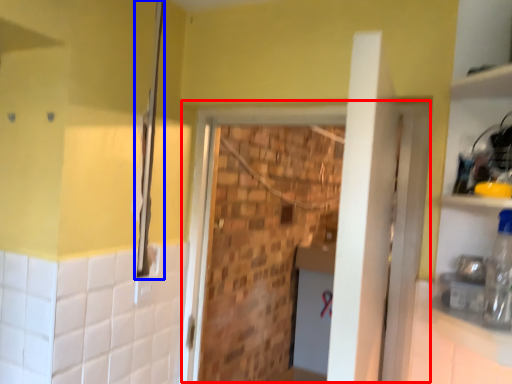
Question: Which object is further to the camera taking this photo, screen door (highlighted by a red box) or shower (highlighted by a blue box)?

Choices:
 (A) screen door
 (B) shower

Answer: (B)